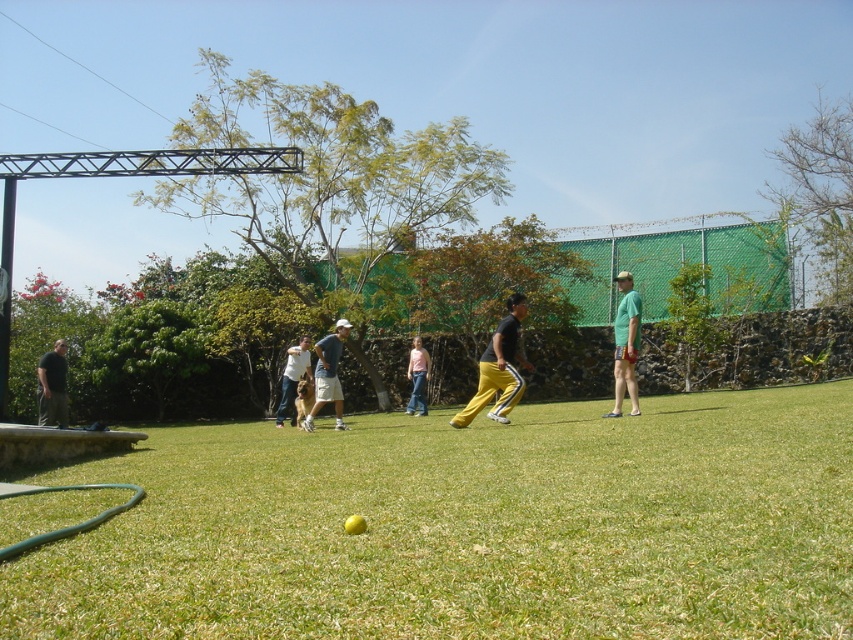
Is dark gray shirt at left further to the viewer compared to light blue denim jeans at center?

No, it is not.

Can you confirm if dark gray shirt at left is wider than light blue denim jeans at center?

Correct, the width of dark gray shirt at left exceeds that of light blue denim jeans at center.

The width and height of the screenshot is (853, 640). Find the location of `dark gray shirt at left`. dark gray shirt at left is located at coordinates (51, 387).

What do you see at coordinates (498, 369) in the screenshot? This screenshot has height=640, width=853. I see `black matte pants at center` at bounding box center [498, 369].

Who is more distant from viewer, [514,355] or [57,394]?

Point [57,394]

Is point (523, 308) farther from camera compared to point (57, 420)?

That is False.

At what (x,y) coordinates should I click in order to perform the action: click on black matte pants at center. Please return your answer as a coordinate pair (x, y). Looking at the image, I should click on (498, 369).

Is tan cotton shorts at center positioned in front of dark gray shirt at left?

Yes, it is in front of dark gray shirt at left.

The width and height of the screenshot is (853, 640). What do you see at coordinates (328, 376) in the screenshot? I see `tan cotton shorts at center` at bounding box center [328, 376].

What do you see at coordinates (328, 376) in the screenshot?
I see `tan cotton shorts at center` at bounding box center [328, 376].

The width and height of the screenshot is (853, 640). What are the coordinates of `tan cotton shorts at center` in the screenshot? It's located at (328, 376).